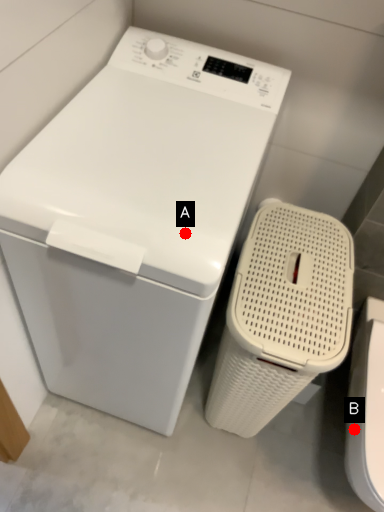
Question: Two points are circled on the image, labeled by A and B beside each circle. Which point is farther to the camera?

Choices:
 (A) A is further
 (B) B is further

Answer: (B)